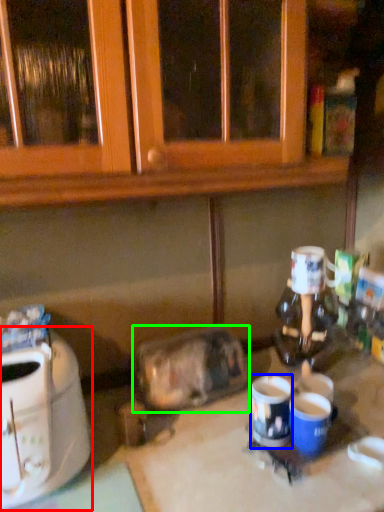
Question: Considering the real-world distances, which object is farthest from toaster (highlighted by a red box)? coffee cup (highlighted by a blue box) or appliance (highlighted by a green box)?

Choices:
 (A) coffee cup
 (B) appliance

Answer: (A)